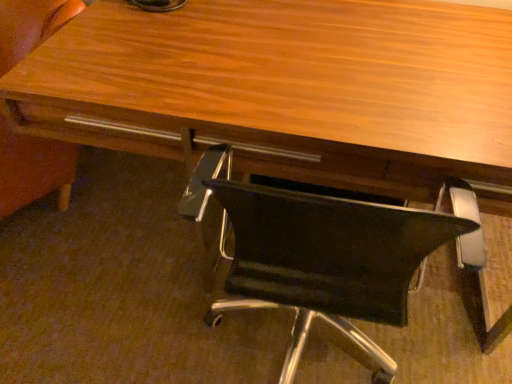
What do you see at coordinates (319, 255) in the screenshot? The width and height of the screenshot is (512, 384). I see `black leather chair at lower center` at bounding box center [319, 255].

At what (x,y) coordinates should I click in order to perform the action: click on black leather chair at lower center. Please return your answer as a coordinate pair (x, y). Looking at the image, I should click on (319, 255).

Identify the location of black leather chair at lower center. (319, 255).